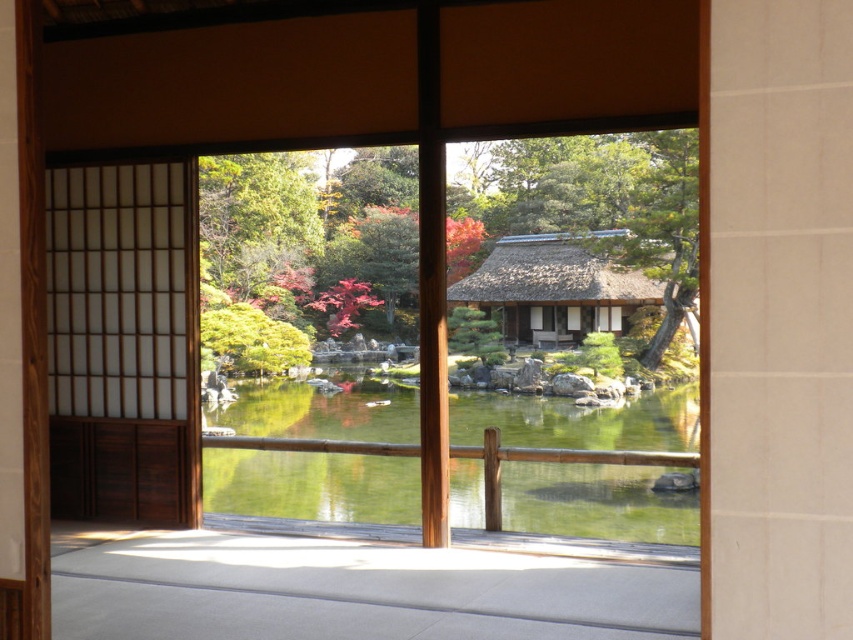
You are standing in a traditional Japanese room with a tatami mat floor. You see the green reflective water at center and the wooden shoji screen at left. Which object is located below the other?

The green reflective water at center is positioned under the wooden shoji screen at left, so the water is below the screen.

You are standing in a traditional Japanese room with a sliding door that opens to a garden. You see two points marked in the scene. The first point is at coordinates point (325,422) and the second is at point (90,253). Which point is closer to you?

Point (325,422) is closer to you than point (90,253) because it is further to the viewer.

You are a visitor in the Japanese garden and want to take a photo of the wooden shoji screen at left and the green reflective water at center. Which object is wider in the scene?

The green reflective water at center might be wider than wooden shoji screen at left.